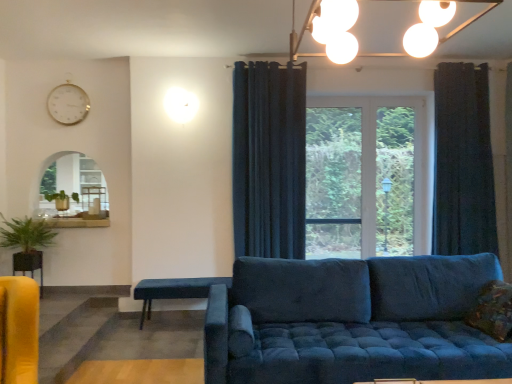
Image resolution: width=512 pixels, height=384 pixels. In order to click on free point above matte white table at left, which is the second table from right to left (from a real-world perspective) in this screenshot , I will do `click(93, 178)`.